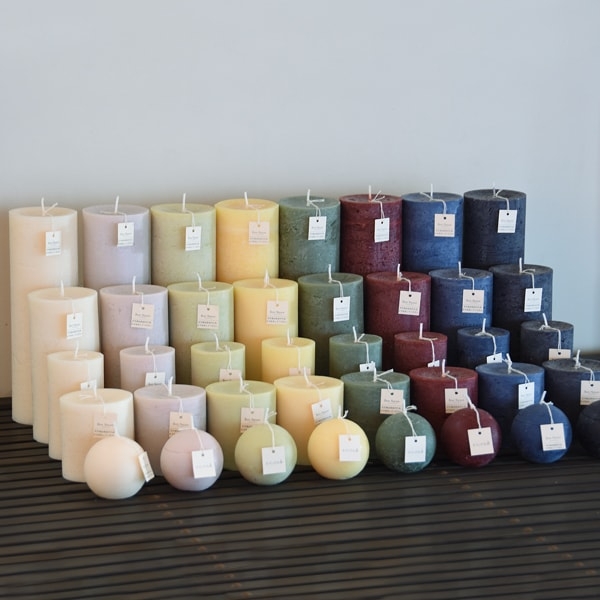
The image size is (600, 600). Identify the location of candles in middle row. (83, 366), (132, 363), (201, 360), (268, 357), (340, 355), (406, 352), (466, 344), (531, 336).